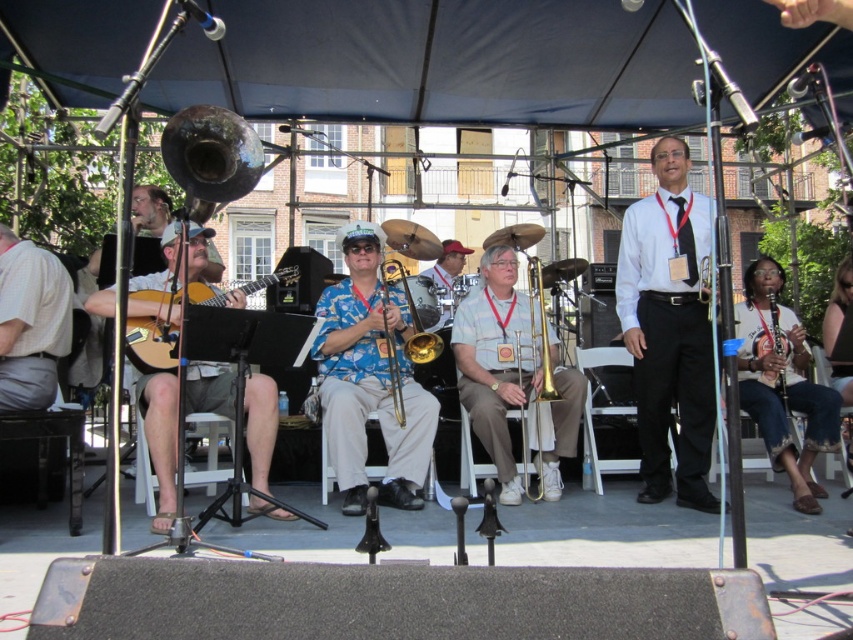
Question: Which object is farther from the camera taking this photo?

Choices:
 (A) matte acoustic guitar at left
 (B) blue floral shirt at center
 (C) gold brass trumpet at center

Answer: (C)

Question: Which of the following is the farthest from the observer?

Choices:
 (A) acoustic guitar at left
 (B) black matte tie at center
 (C) blue floral shirt at center

Answer: (B)

Question: Is acoustic guitar at left thinner than gold brass trumpet at center?

Choices:
 (A) no
 (B) yes

Answer: (A)

Question: Is gold shiny trombone at center closer to the viewer compared to gold brass trumpet at center?

Choices:
 (A) yes
 (B) no

Answer: (A)

Question: Is acoustic guitar at left smaller than matte acoustic guitar at left?

Choices:
 (A) no
 (B) yes

Answer: (A)

Question: Which object is closer to the camera taking this photo?

Choices:
 (A) gold brass trumpet at center
 (B) gold shiny trombone at center
 (C) acoustic guitar at left

Answer: (C)